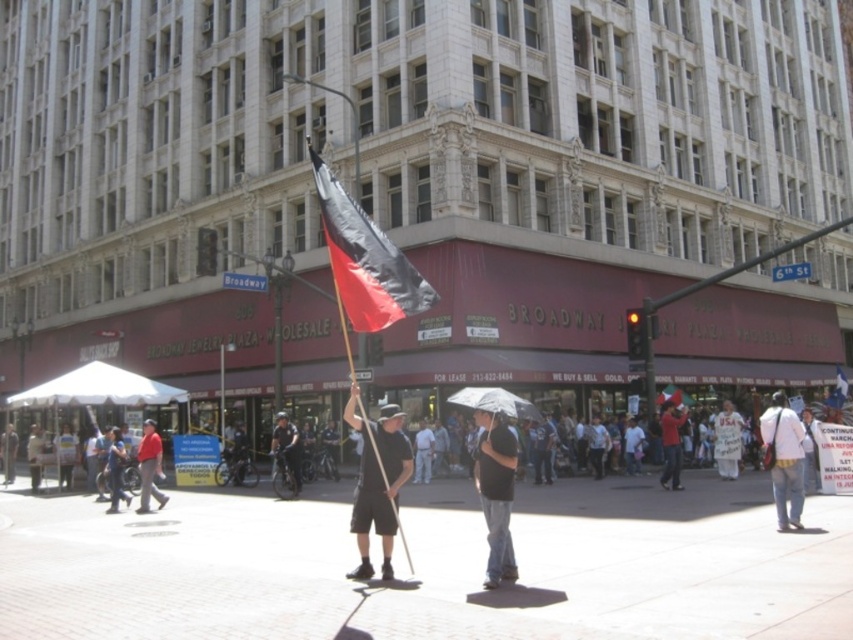
Question: Which of these objects is positioned farthest from the matte black shorts at center?

Choices:
 (A) black fabric flag at center
 (B) white cotton shirt at center
 (C) black matte umbrella at center
 (D) red shirt at center

Answer: (B)

Question: Is black fabric flag at center to the left of white cotton shirt at center from the viewer's perspective?

Choices:
 (A) no
 (B) yes

Answer: (B)

Question: Which point is farther from the camera taking this photo?

Choices:
 (A) (672, 420)
 (B) (361, 493)
 (C) (532, 413)
 (D) (506, 563)

Answer: (A)

Question: Which object is positioned closest to the transparent plastic umbrella at center?

Choices:
 (A) black fabric flag at center
 (B) white cotton shirt at center
 (C) black matte umbrella at center

Answer: (C)

Question: Does transparent plastic umbrella at center appear under red fabric umbrella at center?

Choices:
 (A) yes
 (B) no

Answer: (B)

Question: Is matte black shorts at center bigger than red fabric umbrella at center?

Choices:
 (A) yes
 (B) no

Answer: (A)